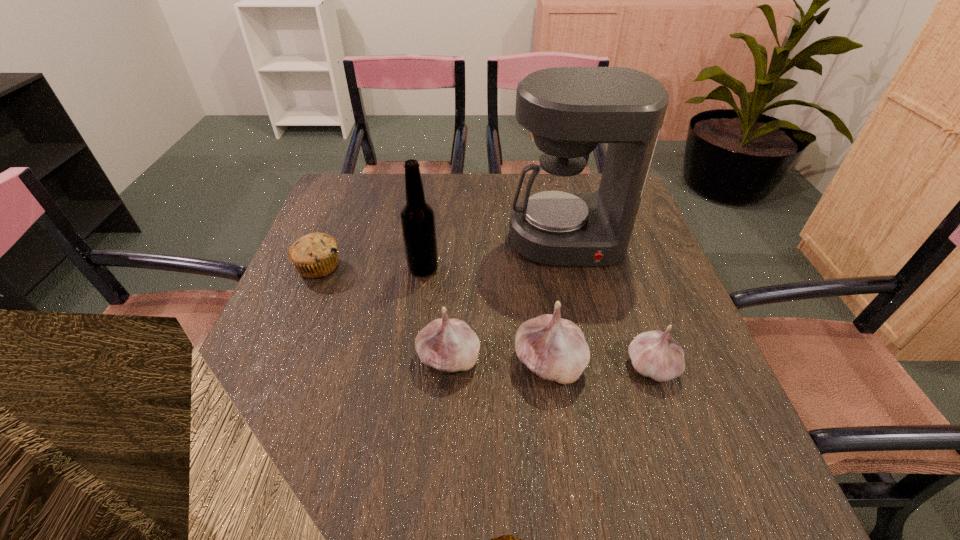
This screenshot has width=960, height=540. In order to click on free region located on the left of the second garlic from left to right in this screenshot , I will do `click(440, 362)`.

Image resolution: width=960 pixels, height=540 pixels. I want to click on blank space located on the right of the fifth tallest object, so click(712, 366).

Where is `vacant region located 0.310m on the button side of the coffee maker`? This screenshot has width=960, height=540. vacant region located 0.310m on the button side of the coffee maker is located at coordinates (598, 376).

The image size is (960, 540). I want to click on vacant space situated 0.130m on the left of the beer bottle, so click(x=355, y=268).

Where is `free space located on the right of the shortest object`? The width and height of the screenshot is (960, 540). free space located on the right of the shortest object is located at coordinates (451, 267).

You are a GUI agent. You are given a task and a screenshot of the screen. Output one action in this format:
    pyautogui.click(x=<x>, y=<y>)
    Task: Click on the object at the far edge
    The width and height of the screenshot is (960, 540).
    Given the screenshot: What is the action you would take?
    pyautogui.click(x=569, y=110)

Where is `object that is at the left edge`? object that is at the left edge is located at coordinates (315, 255).

The width and height of the screenshot is (960, 540). Find the location of `garlic located at the right edge`. garlic located at the right edge is located at coordinates (655, 354).

Where is `coffee maker at the right edge`? Image resolution: width=960 pixels, height=540 pixels. coffee maker at the right edge is located at coordinates (569, 110).

Locate an element on the screen. The height and width of the screenshot is (540, 960). object that is positioned at the far right corner is located at coordinates (569, 110).